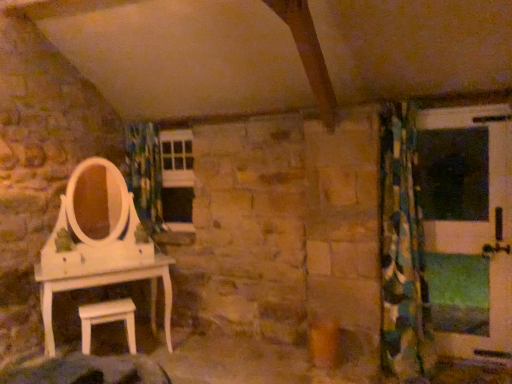
Question: Is white matte stool at lower left looking in the opposite direction of blue-green patterned fabric at center?

Choices:
 (A) yes
 (B) no

Answer: (B)

Question: Can you confirm if white matte stool at lower left is taller than blue-green patterned fabric at center?

Choices:
 (A) no
 (B) yes

Answer: (A)

Question: Considering the relative sizes of white matte stool at lower left and blue-green patterned fabric at center in the image provided, is white matte stool at lower left smaller than blue-green patterned fabric at center?

Choices:
 (A) yes
 (B) no

Answer: (A)

Question: From the image's perspective, is white matte stool at lower left under blue-green patterned fabric at center?

Choices:
 (A) no
 (B) yes

Answer: (B)

Question: Is white matte stool at lower left at the left side of blue-green patterned fabric at center?

Choices:
 (A) yes
 (B) no

Answer: (B)

Question: Is point (160, 173) positioned closer to the camera than point (129, 327)?

Choices:
 (A) farther
 (B) closer

Answer: (A)

Question: From a real-world perspective, is blue-green patterned fabric at center positioned above or below white matte stool at lower left?

Choices:
 (A) above
 (B) below

Answer: (A)

Question: From their relative heights in the image, would you say blue-green patterned fabric at center is taller or shorter than white matte stool at lower left?

Choices:
 (A) short
 (B) tall

Answer: (B)

Question: Which is correct: blue-green patterned fabric at center is inside white matte stool at lower left, or outside of it?

Choices:
 (A) inside
 (B) outside

Answer: (B)

Question: Based on their sizes in the image, would you say white matte stool at lower left is bigger or smaller than green and blue patterned curtain at right?

Choices:
 (A) small
 (B) big

Answer: (A)

Question: In the image, is white matte stool at lower left positioned in front of or behind green and blue patterned curtain at right?

Choices:
 (A) front
 (B) behind

Answer: (B)

Question: From a real-world perspective, is white matte stool at lower left positioned above or below green and blue patterned curtain at right?

Choices:
 (A) above
 (B) below

Answer: (B)

Question: Is point (88, 319) positioned closer to the camera than point (388, 288)?

Choices:
 (A) closer
 (B) farther

Answer: (A)

Question: Considering the positions of green and blue patterned curtain at right and green matte screen door at right in the image, is green and blue patterned curtain at right taller or shorter than green matte screen door at right?

Choices:
 (A) tall
 (B) short

Answer: (A)

Question: Considering the positions of point (397, 321) and point (455, 132), is point (397, 321) closer or farther from the camera than point (455, 132)?

Choices:
 (A) farther
 (B) closer

Answer: (B)